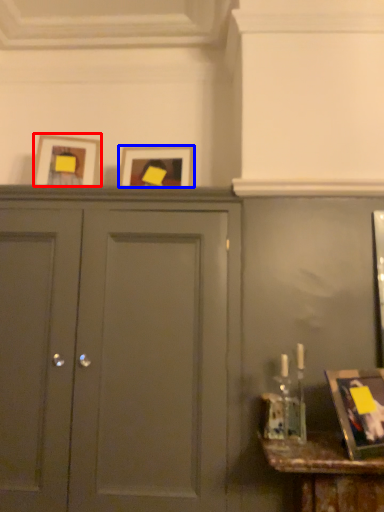
Question: Among these objects, which one is farthest to the camera, picture frame (highlighted by a red box) or picture frame (highlighted by a blue box)?

Choices:
 (A) picture frame
 (B) picture frame

Answer: (B)